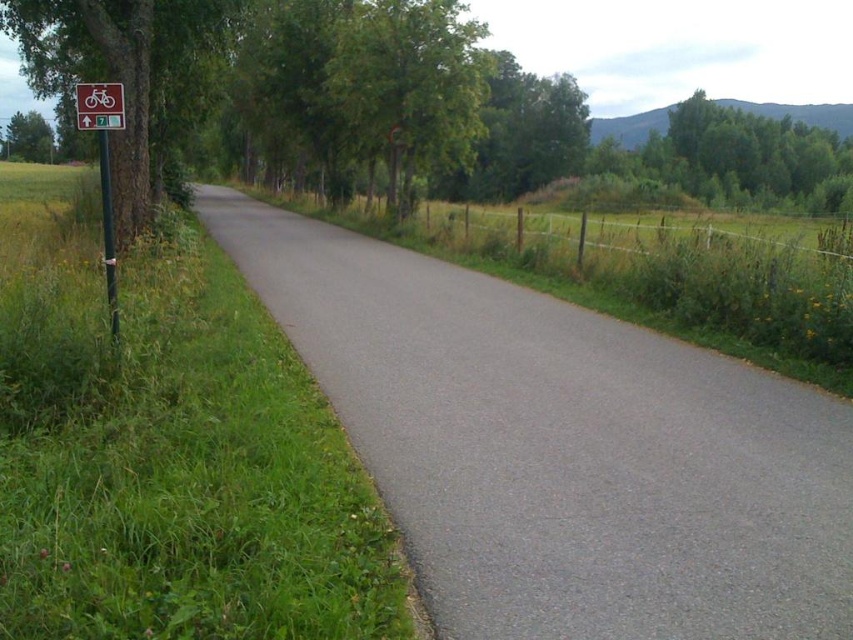
Question: Which object is positioned closest to the white plastic bicycle sign at upper left?

Choices:
 (A) green leafy tree at left
 (B) red plastic sign at left

Answer: (B)

Question: Does green leafy tree at left have a greater width compared to green metallic pole at left?

Choices:
 (A) no
 (B) yes

Answer: (B)

Question: Is red plastic sign at left to the right of green metallic pole at left from the viewer's perspective?

Choices:
 (A) no
 (B) yes

Answer: (A)

Question: Which of the following is the closest to the observer?

Choices:
 (A) white plastic bicycle sign at upper left
 (B) green leafy tree at left
 (C) gray asphalt road at center

Answer: (C)

Question: Can you confirm if red plastic sign at left is positioned below white plastic bicycle sign at upper left?

Choices:
 (A) yes
 (B) no

Answer: (A)

Question: Considering the real-world distances, which object is farthest from the green metallic pole at left?

Choices:
 (A) red plastic sign at left
 (B) white plastic bicycle sign at upper left
 (C) gray asphalt road at center
 (D) green leafy tree at left

Answer: (C)